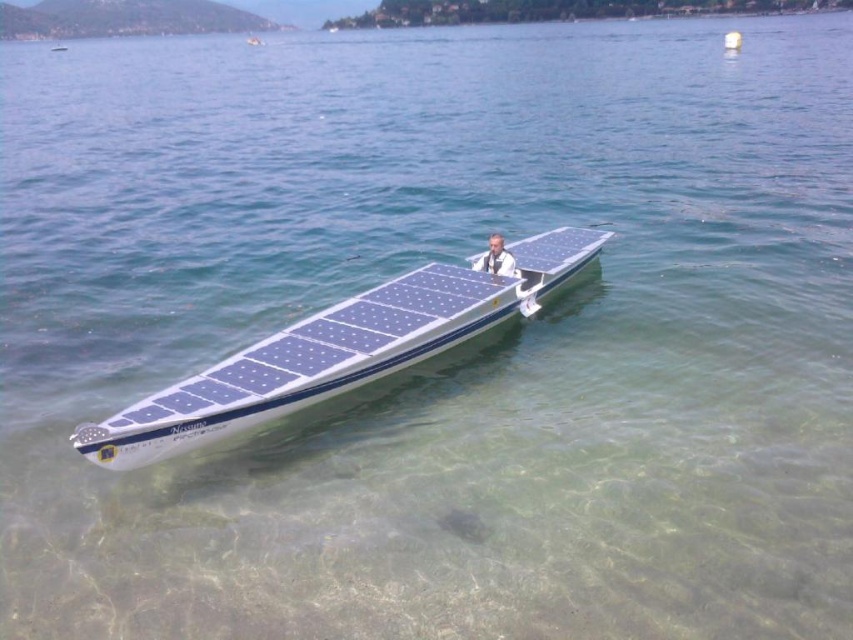
Who is shorter, blue solar panel boat at center or light brown leather jacket at center?

light brown leather jacket at center

Can you confirm if blue solar panel boat at center is positioned to the left of light brown leather jacket at center?

Correct, you'll find blue solar panel boat at center to the left of light brown leather jacket at center.

What are the coordinates of `blue solar panel boat at center` in the screenshot? It's located at (335, 352).

Identify the location of blue solar panel boat at center. The image size is (853, 640). (335, 352).